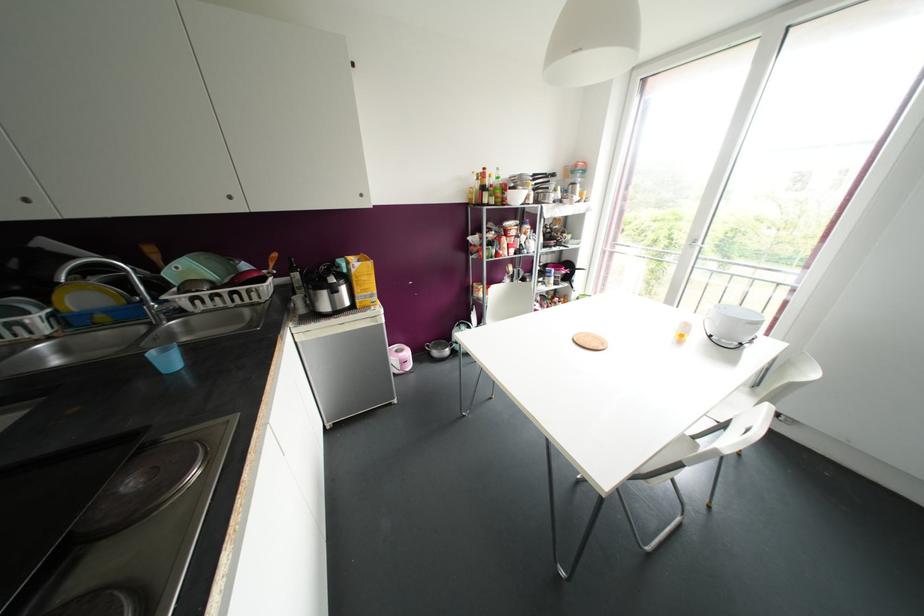
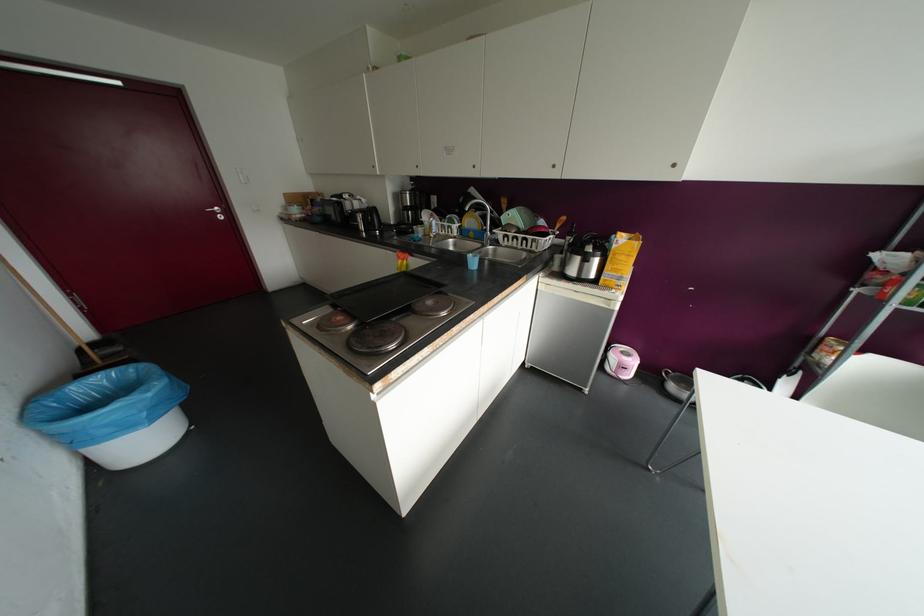
In the second image, find the point that corresponds to point 228,197 in the first image.

(553, 166)